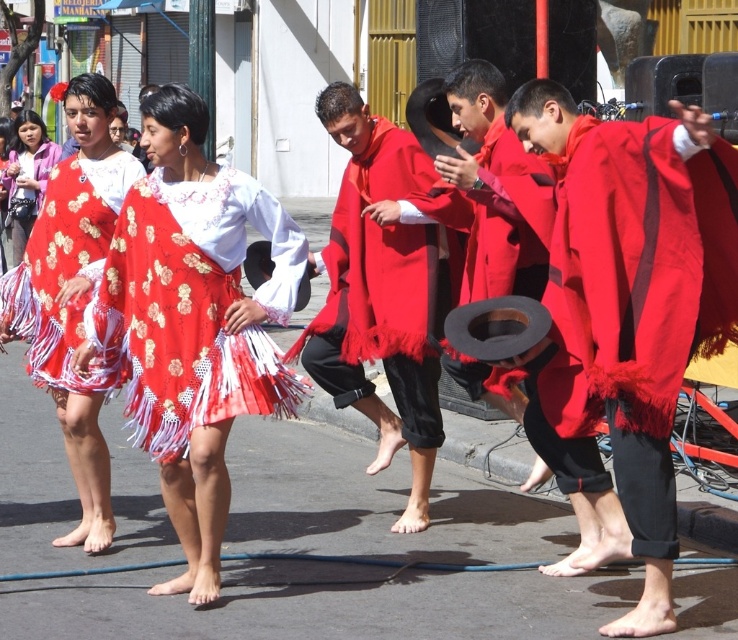
You are a photographer trying to capture the dancers in the image. You notice the matte floral skirt at center and the matte pink blouse at left. Which one is positioned lower in the image?

The matte floral skirt at center is located below the matte pink blouse at left, so it is positioned lower in the image.